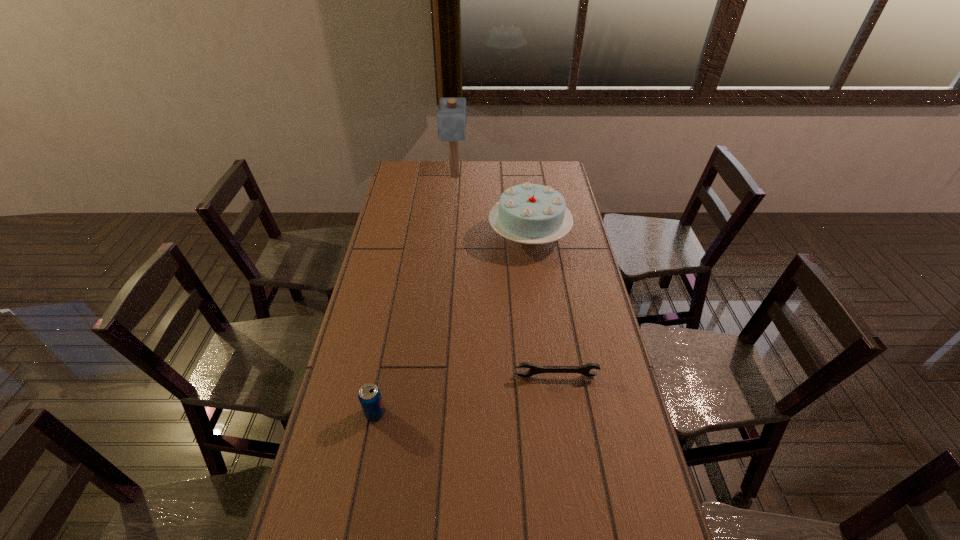
Image resolution: width=960 pixels, height=540 pixels. Identify the location of free space located on the back of the pop soda. (396, 307).

Image resolution: width=960 pixels, height=540 pixels. Identify the location of free space located 0.380m on the open ends of the right wrench. (577, 508).

Identify the location of object that is at the far edge. Image resolution: width=960 pixels, height=540 pixels. (451, 118).

Identify the location of object located at the left edge. This screenshot has height=540, width=960. (369, 395).

Identify the location of birthday cake present at the right edge. Image resolution: width=960 pixels, height=540 pixels. (528, 213).

What are the coordinates of `wrench at the right edge` in the screenshot? It's located at (585, 369).

You are a GUI agent. You are given a task and a screenshot of the screen. Output one action in this format:
    pyautogui.click(x=<x>, y=<y>)
    Task: Click on the vacant space at the far edge
    
    Given the screenshot: What is the action you would take?
    pyautogui.click(x=434, y=172)

Where is `vacant space at the left edge of the desktop`? vacant space at the left edge of the desktop is located at coordinates (385, 246).

This screenshot has width=960, height=540. I want to click on free space at the right edge, so click(583, 442).

In the image, there is a desktop. At what (x,y) coordinates should I click in order to perform the action: click on vacant space at the far left corner. Please return your answer as a coordinate pair (x, y). Image resolution: width=960 pixels, height=540 pixels. Looking at the image, I should click on (408, 163).